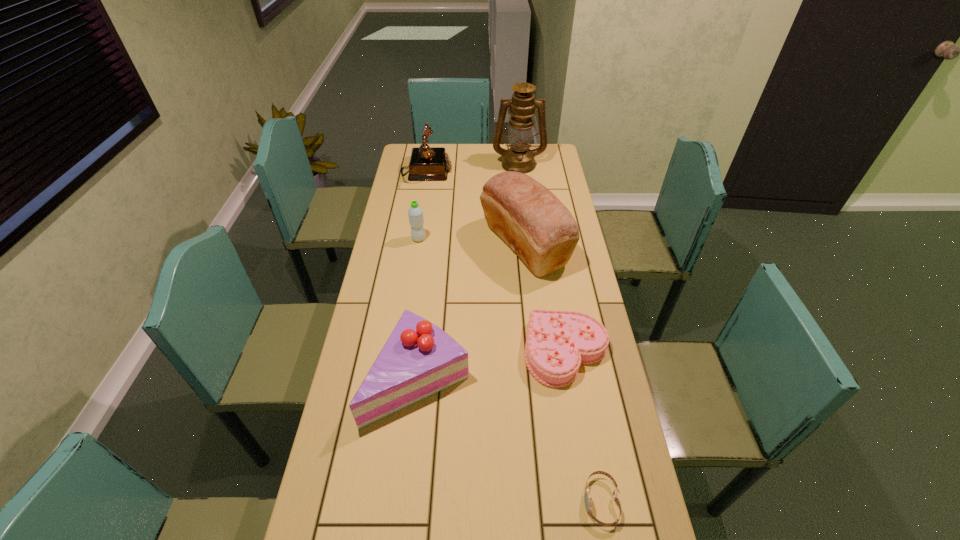
Find the location of `free space at the left edge`. free space at the left edge is located at coordinates (403, 250).

The width and height of the screenshot is (960, 540). Identify the location of vacant space at the right edge. (598, 399).

What are the coordinates of `vacant space at the far right corner of the desktop` in the screenshot? It's located at (539, 161).

The image size is (960, 540). I want to click on vacant area between the left cake and the sixth tallest object, so click(492, 365).

Image resolution: width=960 pixels, height=540 pixels. Identify the location of blank region between the telephone and the water bottle. (422, 206).

Locate an element on the screen. The height and width of the screenshot is (540, 960). empty space that is in between the water bottle and the nearest object is located at coordinates (510, 370).

Where is `vacant space that is in between the oil lamp and the water bottle`? Image resolution: width=960 pixels, height=540 pixels. vacant space that is in between the oil lamp and the water bottle is located at coordinates (468, 201).

Where is `free area in between the telephone and the shortest object`? The height and width of the screenshot is (540, 960). free area in between the telephone and the shortest object is located at coordinates (514, 337).

Find the location of `object identified as the closest to the telephone`. object identified as the closest to the telephone is located at coordinates tap(519, 158).

What are the coordinates of `object that ranks as the second closest to the nearest object` in the screenshot? It's located at (419, 359).